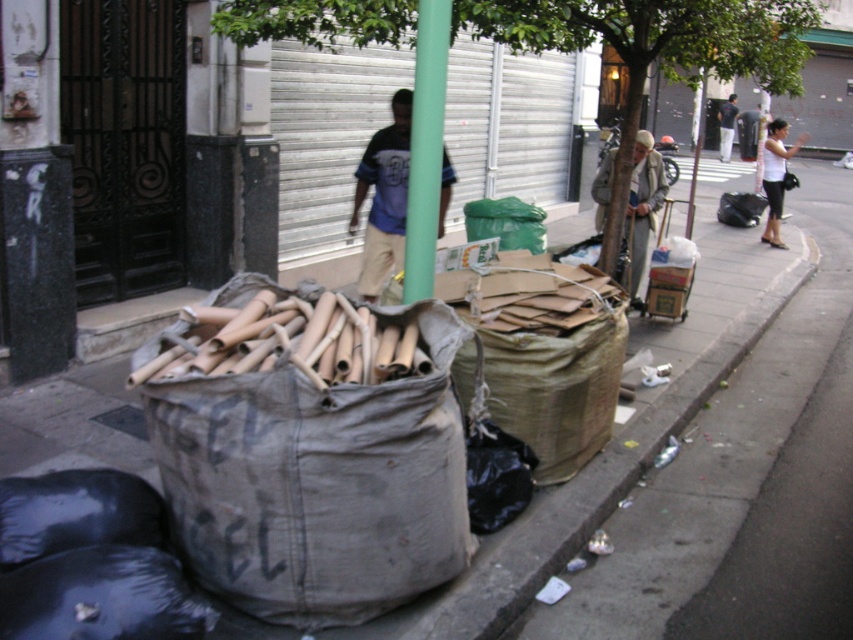
Does matte blue shirt at center lie in front of gray woolen sweater at center?

No.

Does point (401, 134) come behind point (660, 195)?

No, it is not.

This screenshot has height=640, width=853. What are the coordinates of `matte blue shirt at center` in the screenshot? It's located at (383, 196).

Describe the element at coordinates (740, 209) in the screenshot. I see `black plastic bag at right` at that location.

Is point (755, 211) closer to viewer compared to point (728, 109)?

Yes.

Is point (756, 221) positioned before point (727, 141)?

Yes, it is in front of point (727, 141).

This screenshot has height=640, width=853. What are the coordinates of `black plastic bag at right` in the screenshot? It's located at (740, 209).

Is green matte pole at center to the right of gray woolen sweater at center from the viewer's perspective?

No, green matte pole at center is not to the right of gray woolen sweater at center.

Is point (434, 221) farther from viewer compared to point (630, 266)?

No, it is not.

Based on the photo, who is more distant from viewer, (409,282) or (593,179)?

Point (593,179)

Identify the location of green matte pole at center. (425, 147).